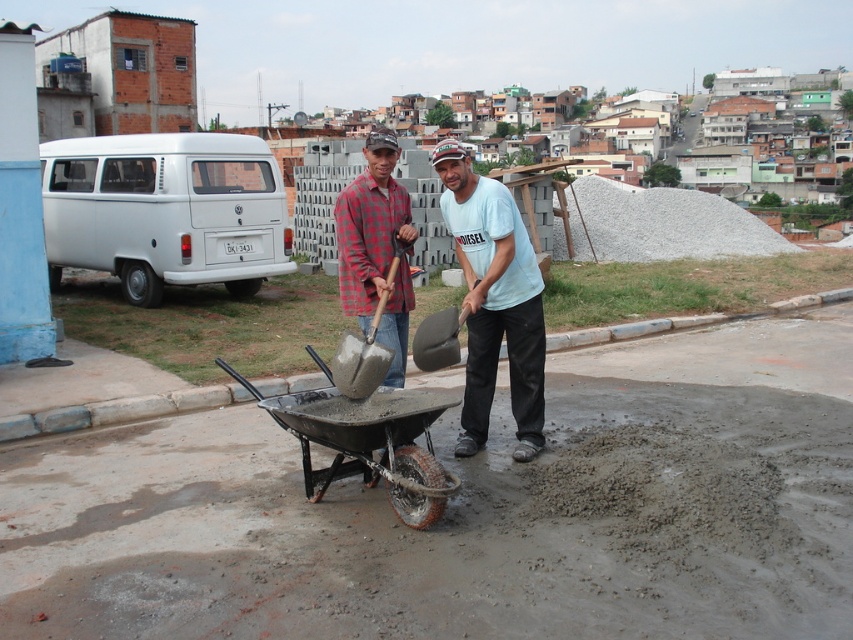
Question: Among these objects, which one is farthest from the camera?

Choices:
 (A) matte gray shovel at center
 (B) matte concrete shovel at center
 (C) metallic gray wheelbarrow at center

Answer: (B)

Question: Which object is the closest to the matte concrete shovel at center?

Choices:
 (A) matte gray shovel at center
 (B) metallic gray wheelbarrow at center

Answer: (B)

Question: Considering the relative positions of matte concrete shovel at center and metallic gray wheelbarrow at center in the image provided, where is matte concrete shovel at center located with respect to metallic gray wheelbarrow at center?

Choices:
 (A) left
 (B) right

Answer: (B)

Question: Among these objects, which one is nearest to the camera?

Choices:
 (A) matte concrete shovel at center
 (B) metallic gray wheelbarrow at center
 (C) matte gray shovel at center

Answer: (B)

Question: Is the position of metallic gray wheelbarrow at center less distant than that of matte gray shovel at center?

Choices:
 (A) yes
 (B) no

Answer: (A)

Question: Does matte concrete shovel at center appear over matte gray shovel at center?

Choices:
 (A) no
 (B) yes

Answer: (B)